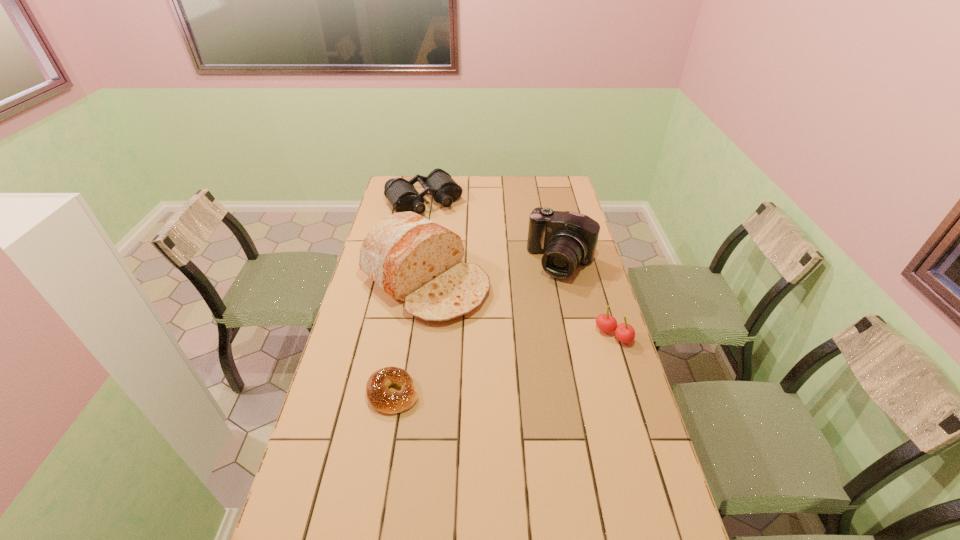
I want to click on free space on the desktop that is between the shortest object and the cherry and is positioned at the sliced end of the bread, so click(535, 356).

At what (x,y) coordinates should I click in order to perform the action: click on vacant spot on the desktop that is between the bagel and the cherry and is positioned on the lens of the camera. Please return your answer as a coordinate pair (x, y). Looking at the image, I should click on (501, 364).

Where is `vacant spot on the desktop that is between the nearest object and the cherry and is positioned through the eyepieces of the farthest object`? The image size is (960, 540). vacant spot on the desktop that is between the nearest object and the cherry and is positioned through the eyepieces of the farthest object is located at coordinates (540, 354).